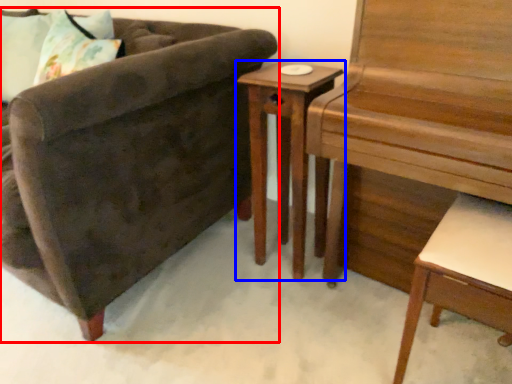
Question: Which point is further to the camera, chair (highlighted by a red box) or nightstand (highlighted by a blue box)?

Choices:
 (A) chair
 (B) nightstand

Answer: (B)